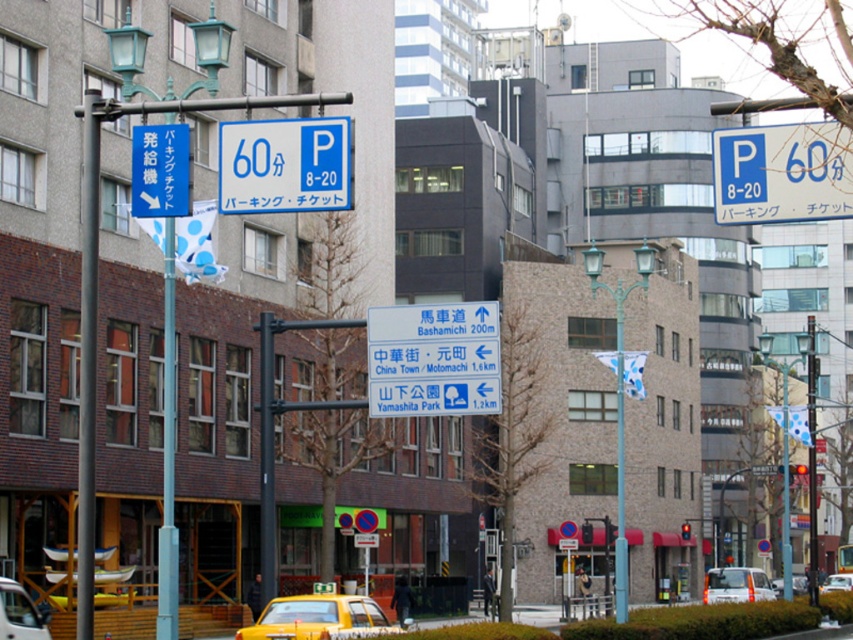
Question: Does metallic pole at left have a smaller size compared to white plastic car at center?

Choices:
 (A) yes
 (B) no

Answer: (B)

Question: Based on their relative distances, which object is nearer to the blue plastic parking sign at upper right?

Choices:
 (A) white plastic car at center
 (B) yellow plastic car at center
 (C) white plastic sign at center
 (D) blue plastic sign at upper left

Answer: (C)

Question: Can you confirm if blue plastic parking sign at upper right is wider than yellow matte taxi at center?

Choices:
 (A) yes
 (B) no

Answer: (B)

Question: Which object appears farthest from the camera in this image?

Choices:
 (A) yellow plastic car at center
 (B) red glass traffic light at center
 (C) blue plastic parking sign at upper right

Answer: (B)

Question: Which point is farther to the camera?

Choices:
 (A) yellow matte taxi cab at lower left
 (B) metallic pole at center

Answer: (B)

Question: Is white plastic sign at center thinner than white plastic car at center?

Choices:
 (A) no
 (B) yes

Answer: (B)